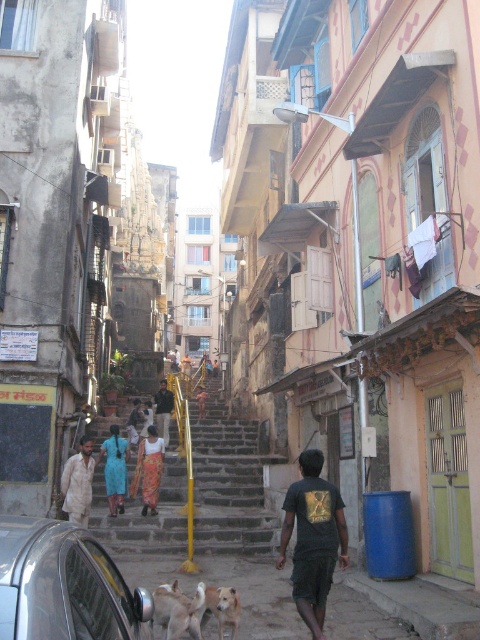
Question: In this image, where is orange printed sari at center located relative to dark blue fabric at center?

Choices:
 (A) above
 (B) below

Answer: (B)

Question: Observing the image, what is the correct spatial positioning of stone textured stairs at center in reference to white fur dog at center?

Choices:
 (A) right
 (B) left

Answer: (B)

Question: Among these points, which one is farthest from the camera?

Choices:
 (A) (99, 448)
 (B) (69, 518)
 (C) (232, 548)
 (D) (166, 404)

Answer: (D)

Question: Which point appears closest to the camera in this image?

Choices:
 (A) (104, 449)
 (B) (72, 492)
 (C) (143, 509)
 (D) (168, 442)

Answer: (B)

Question: Can you confirm if shiny chrome car at lower left is thinner than white fur dog at center?

Choices:
 (A) no
 (B) yes

Answer: (A)

Question: Among these objects, which one is nearest to the camera?

Choices:
 (A) blue cotton dress at center
 (B) shiny chrome car at lower left
 (C) stone textured stairs at center

Answer: (B)